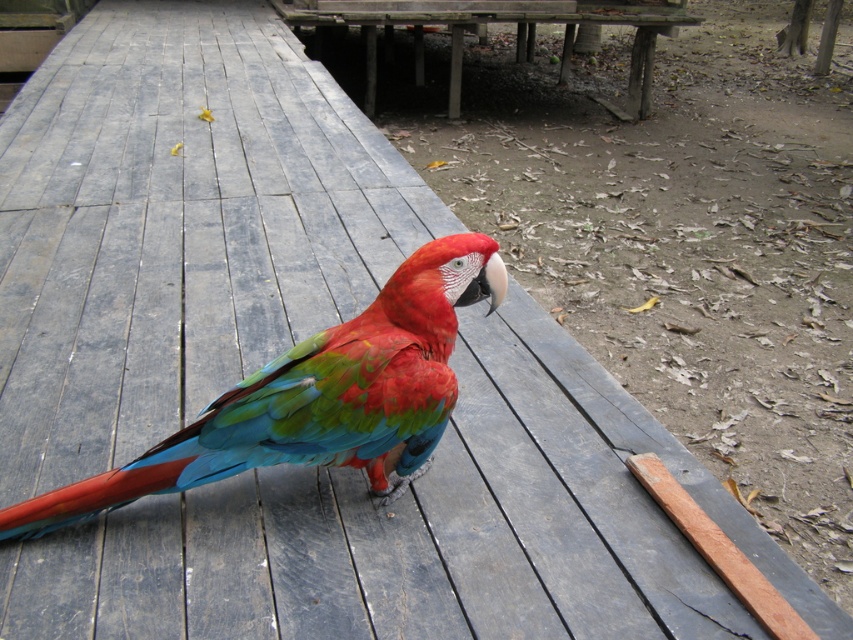
Question: Can you confirm if shiny multicolored parrot at center is positioned above wooden picnic table at center?

Choices:
 (A) yes
 (B) no

Answer: (B)

Question: Among these objects, which one is farthest from the camera?

Choices:
 (A) wooden picnic table at center
 (B) shiny multicolored parrot at center

Answer: (A)

Question: Does shiny multicolored parrot at center appear on the left side of wooden picnic table at center?

Choices:
 (A) yes
 (B) no

Answer: (A)

Question: From the image, what is the correct spatial relationship of shiny multicolored parrot at center in relation to wooden picnic table at center?

Choices:
 (A) right
 (B) left

Answer: (B)